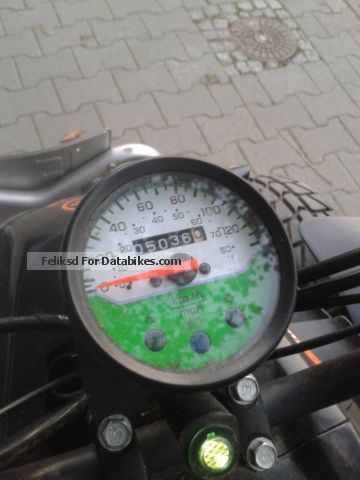
Identify the location of cable. The height and width of the screenshot is (480, 360). (41, 388), (321, 336), (341, 300).